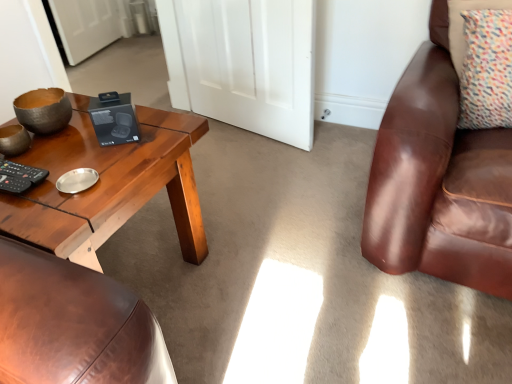
Question: Looking at the image, does multicolored fabric pillow at upper right seem bigger or smaller compared to white matte door at center?

Choices:
 (A) big
 (B) small

Answer: (B)

Question: From the image's perspective, is multicolored fabric pillow at upper right positioned above or below white matte door at center?

Choices:
 (A) below
 (B) above

Answer: (A)

Question: Considering the real-world distances, which object is closest to the woodenmaterial/texturecoffee table at left?

Choices:
 (A) multicolored fabric pillow at upper right
 (B) white matte door at center

Answer: (B)

Question: Which is farther from the woodenmaterial/texturecoffee table at left?

Choices:
 (A) white matte door at center
 (B) multicolored fabric pillow at upper right

Answer: (B)